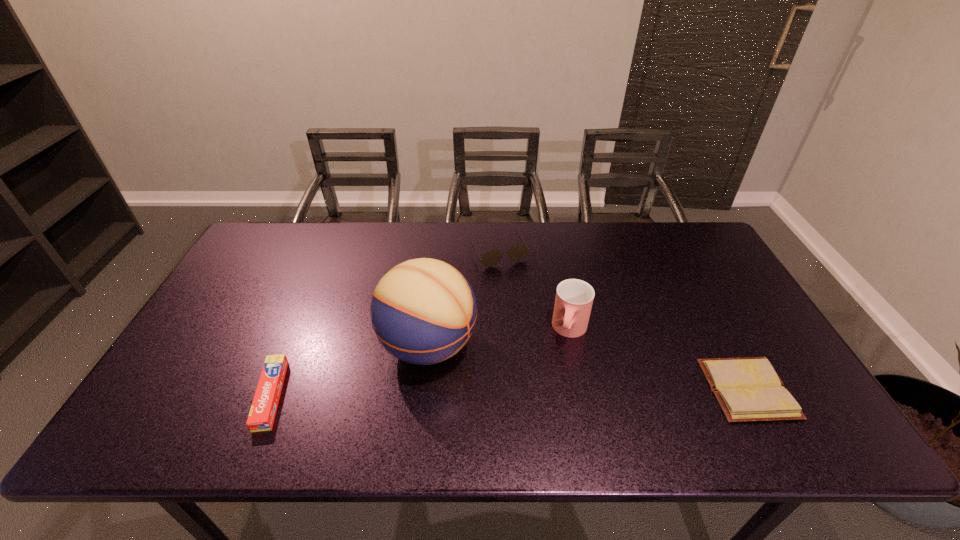
Where is `object located in the far edge section of the desktop`? object located in the far edge section of the desktop is located at coordinates (518, 252).

Find the location of `toothpaste located in the near edge section of the desktop`. toothpaste located in the near edge section of the desktop is located at coordinates (263, 410).

Where is `diary positioned at the near edge`? diary positioned at the near edge is located at coordinates (748, 389).

The width and height of the screenshot is (960, 540). What are the coordinates of `basketball that is positioned at the near edge` in the screenshot? It's located at (423, 311).

At what (x,y) coordinates should I click in order to perform the action: click on object at the right edge. Please return your answer as a coordinate pair (x, y). The height and width of the screenshot is (540, 960). Looking at the image, I should click on (748, 389).

Locate an element on the screen. object located at the near right corner is located at coordinates (748, 389).

In the image, there is a desktop. Find the location of `free space at the far edge`. free space at the far edge is located at coordinates (551, 264).

Identify the location of vacant point at the near edge. Image resolution: width=960 pixels, height=540 pixels. (458, 401).

Locate an element on the screen. This screenshot has width=960, height=540. vacant region at the right edge is located at coordinates (701, 304).

This screenshot has height=540, width=960. In the image, there is a desktop. In order to click on free space at the far left corner in this screenshot , I will do click(270, 239).